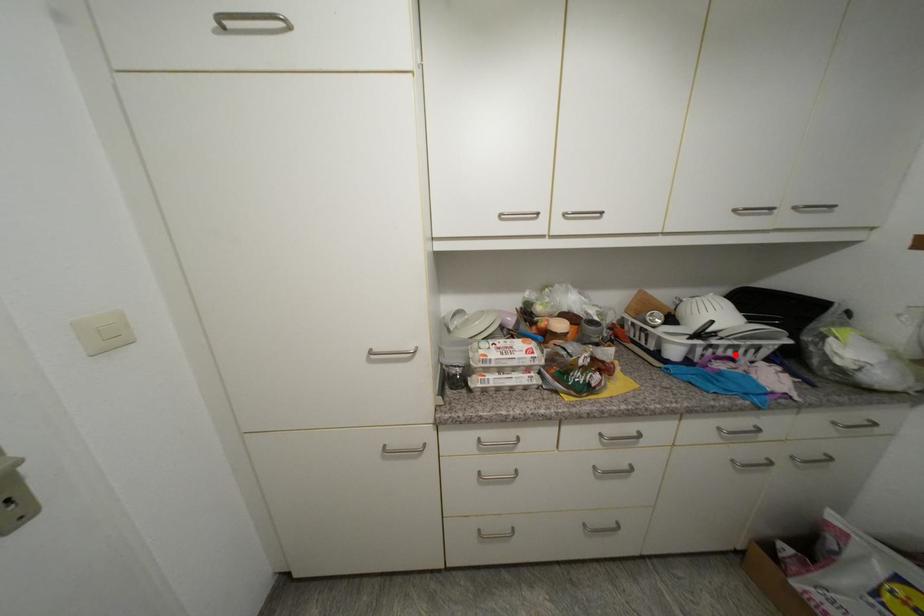
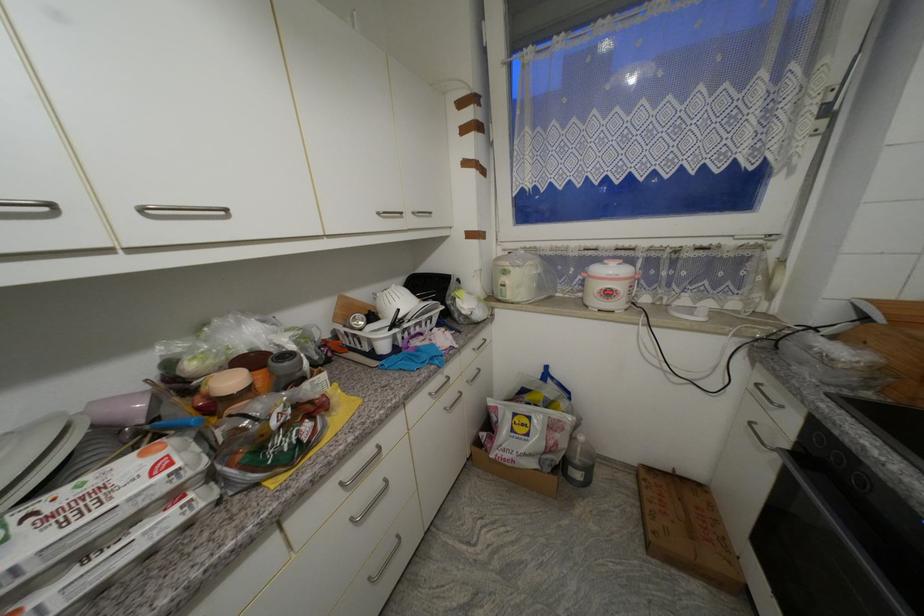
Where in the second image is the point corresponding to the highlighted location from the first image?

(423, 331)